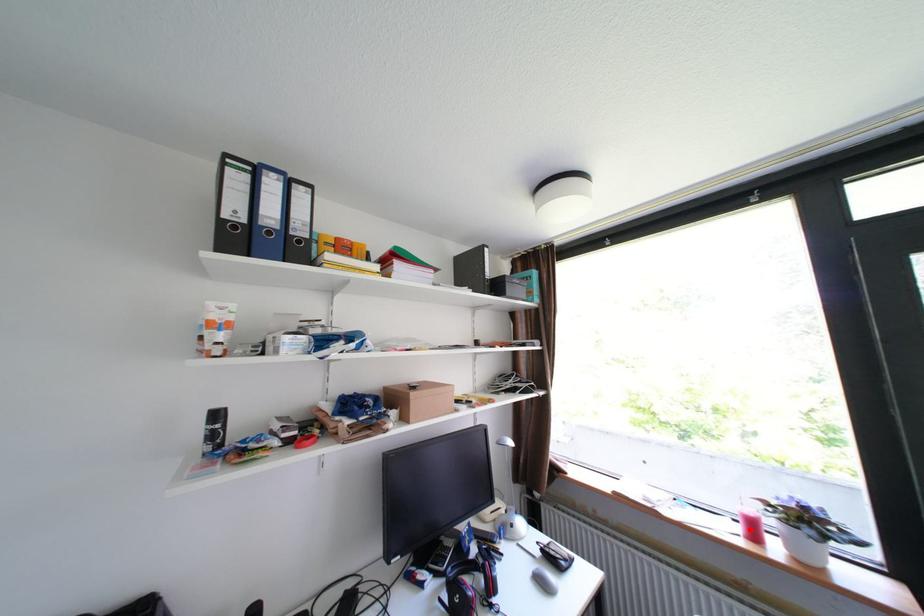
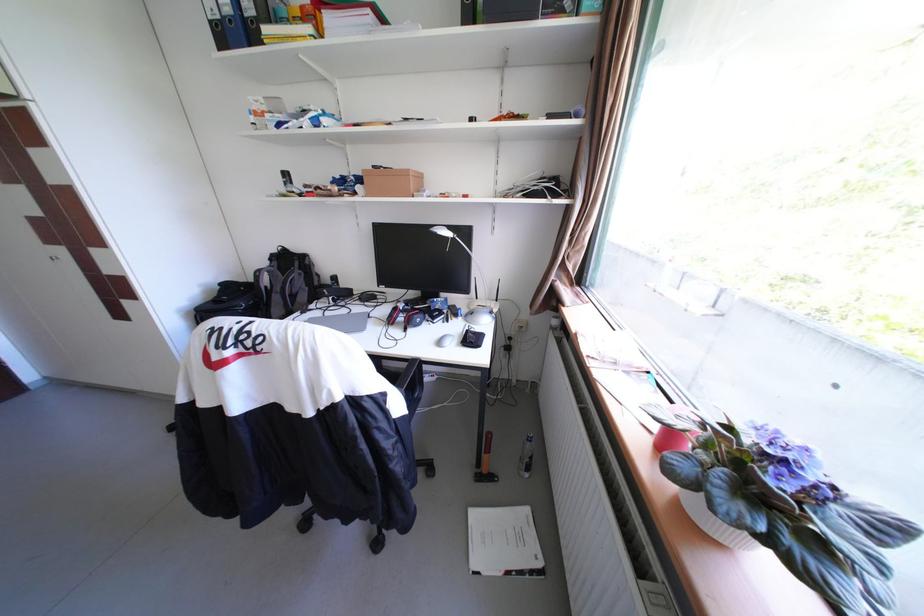
Question: I am providing you with two images of the same scene from different viewpoints. Given a red point in image1, look at the same physical point in image2. Is it:

Choices:
 (A) Closer to the viewpoint
 (B) Farther from the viewpoint

Answer: (B)